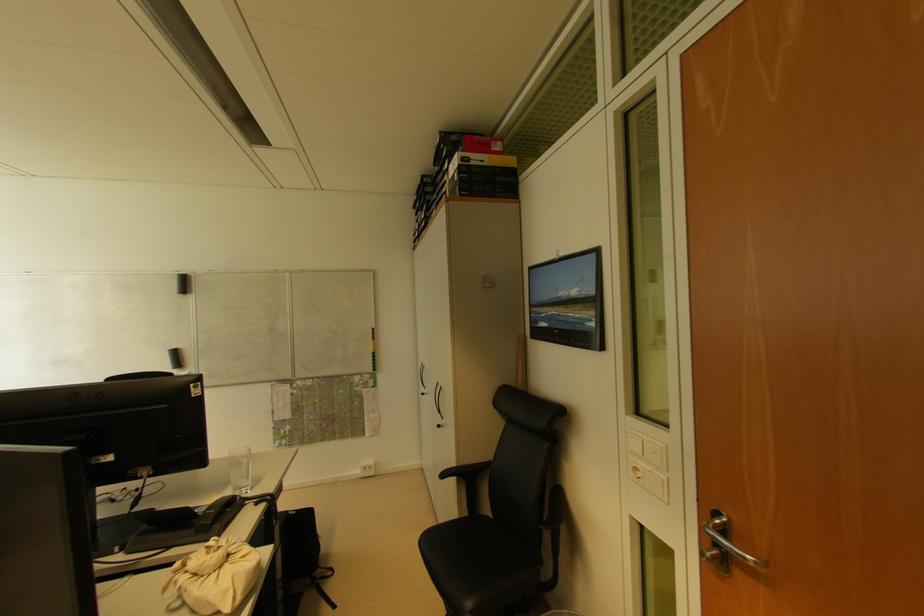
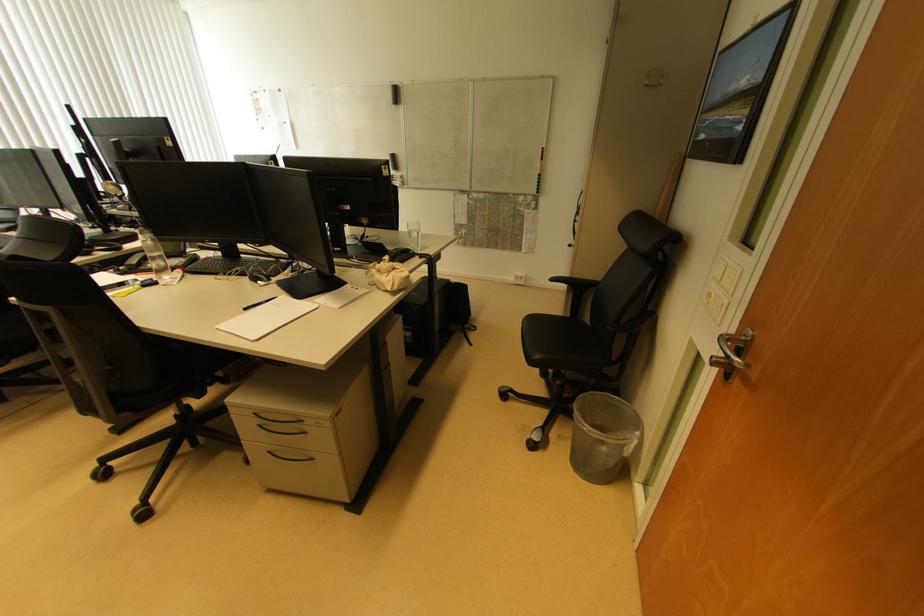
In the second image, find the point that corresponds to [493,520] in the first image.

(590, 328)